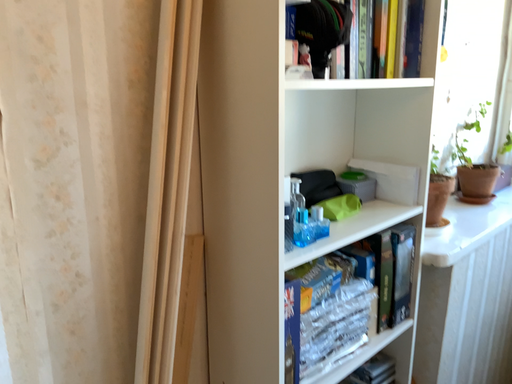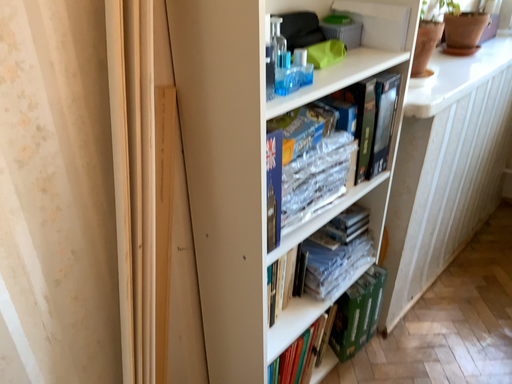
Question: Which way did the camera rotate in the video?

Choices:
 (A) rotated upward
 (B) rotated downward

Answer: (B)